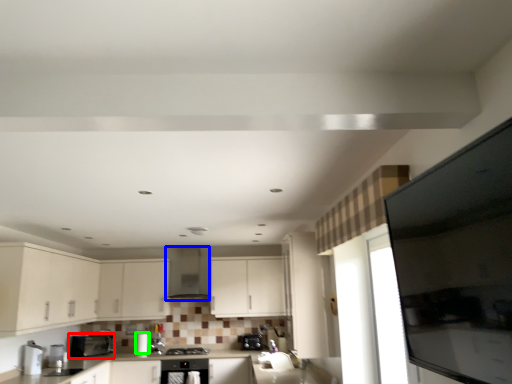
Question: Considering the real-world distances, which object is farthest from home appliance (highlighted by a red box)? exhaust hood (highlighted by a blue box) or appliance (highlighted by a green box)?

Choices:
 (A) exhaust hood
 (B) appliance

Answer: (A)